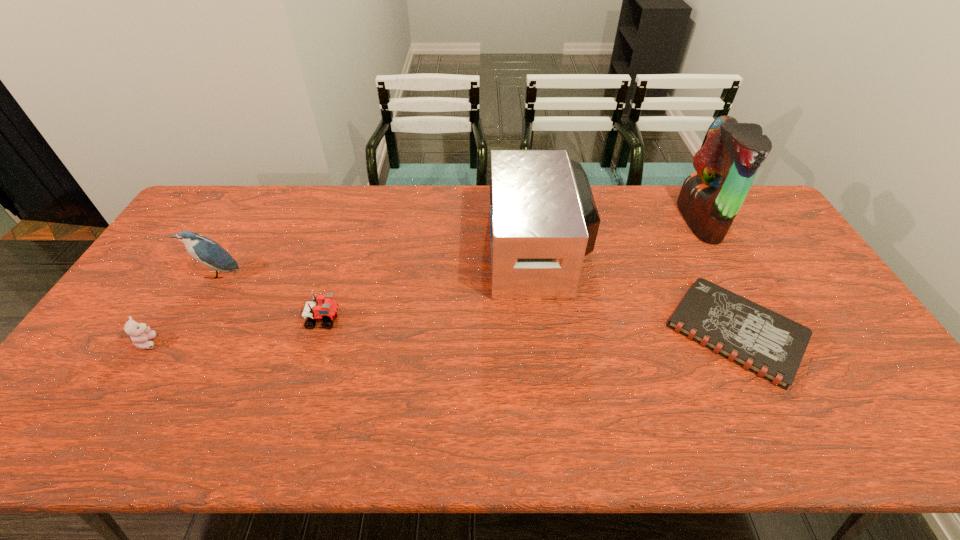
Find the location of a particular element. The height and width of the screenshot is (540, 960). empty space between the Lego and the shortest object is located at coordinates (530, 326).

The width and height of the screenshot is (960, 540). I want to click on free space that is in between the shortest object and the tallest object, so click(x=718, y=276).

You are a GUI agent. You are given a task and a screenshot of the screen. Output one action in this format:
    pyautogui.click(x=<x>, y=<y>)
    Task: Click on the vacant area that lies between the fourth shortest object and the teddy bear
    This screenshot has width=960, height=540.
    Given the screenshot: What is the action you would take?
    pyautogui.click(x=183, y=308)

This screenshot has height=540, width=960. I want to click on vacant area that lies between the shortest object and the tallest object, so click(718, 276).

Identify the location of free spot between the microwave oven and the bird. (377, 262).

The image size is (960, 540). Identify the location of free space between the parrot and the bird. (458, 248).

At what (x,y) coordinates should I click in order to perform the action: click on free spot between the shortest object and the microwave oven. Please return your answer as a coordinate pair (x, y). This screenshot has width=960, height=540. Looking at the image, I should click on (636, 291).

At what (x,y) coordinates should I click in order to perform the action: click on empty location between the bird and the Lego. Please return your answer as a coordinate pair (x, y). Looking at the image, I should click on (271, 297).

Locate an element on the screen. object that is the third closest one to the second tallest object is located at coordinates (323, 308).

The height and width of the screenshot is (540, 960). Identify the location of the fourth closest object relative to the teddy bear. (772, 346).